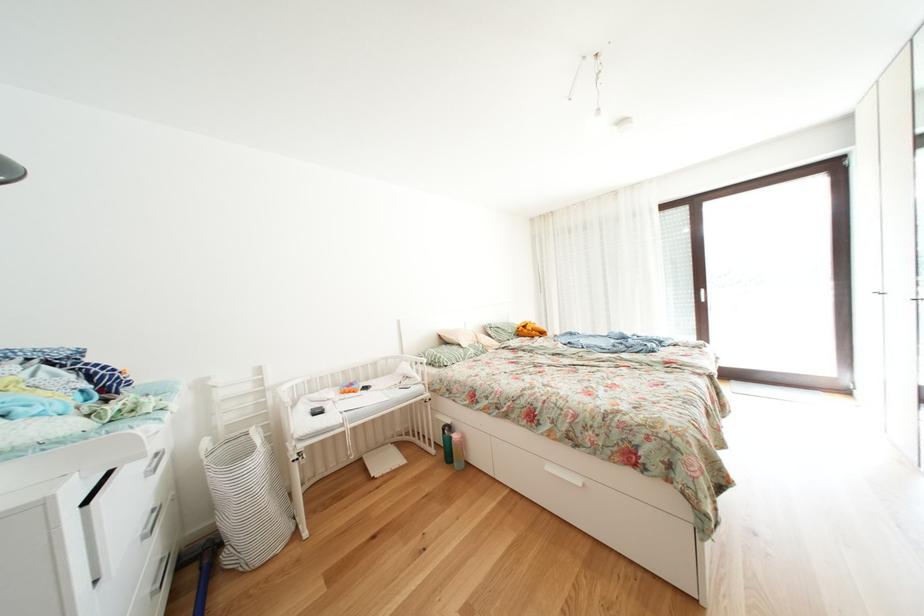
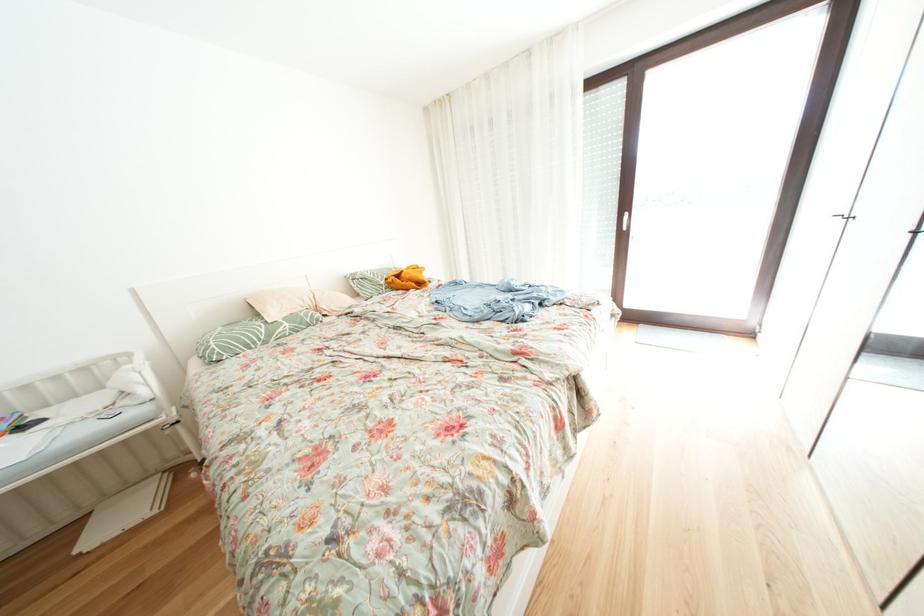
Find the pixel in the second image that matches (x=856, y=397) in the first image.

(759, 339)